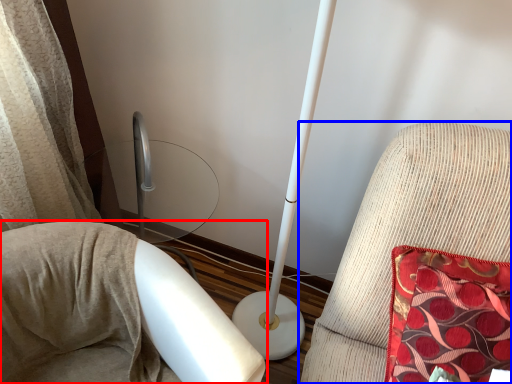
Question: Which object is further to the camera taking this photo, furniture (highlighted by a red box) or furniture (highlighted by a blue box)?

Choices:
 (A) furniture
 (B) furniture

Answer: (B)